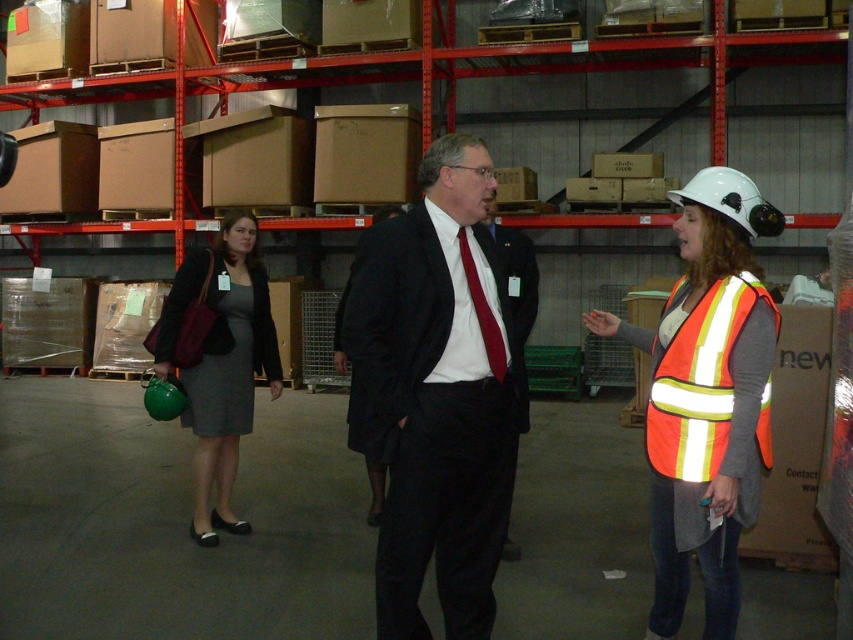
Question: Is dark suit at center behind matte gray dress at left?

Choices:
 (A) no
 (B) yes

Answer: (A)

Question: Which point appears closest to the camera in this image?

Choices:
 (A) (457, 468)
 (B) (189, 262)
 (C) (495, 326)

Answer: (A)

Question: Which of the following is the closest to the observer?

Choices:
 (A) dark suit at center
 (B) red satin tie at center

Answer: (A)

Question: Which is nearer to the red satin tie at center?

Choices:
 (A) reflective orange safety vest at right
 (B) dark suit at center

Answer: (B)

Question: Can you confirm if reflective orange safety vest at center is thinner than matte gray dress at left?

Choices:
 (A) yes
 (B) no

Answer: (A)

Question: Is reflective orange safety vest at center positioned before matte black suit at center?

Choices:
 (A) yes
 (B) no

Answer: (A)